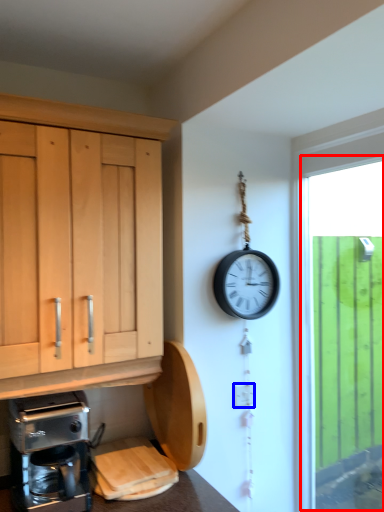
Question: Which point is closer to the camera, window (highlighted by a red box) or electric outlet (highlighted by a blue box)?

Choices:
 (A) window
 (B) electric outlet

Answer: (A)